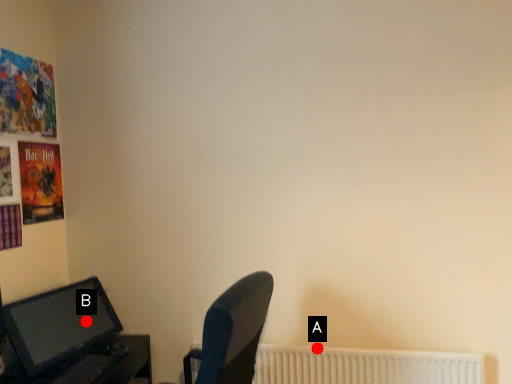
Question: Two points are circled on the image, labeled by A and B beside each circle. Which point is closer to the camera taking this photo?

Choices:
 (A) A is closer
 (B) B is closer

Answer: (A)